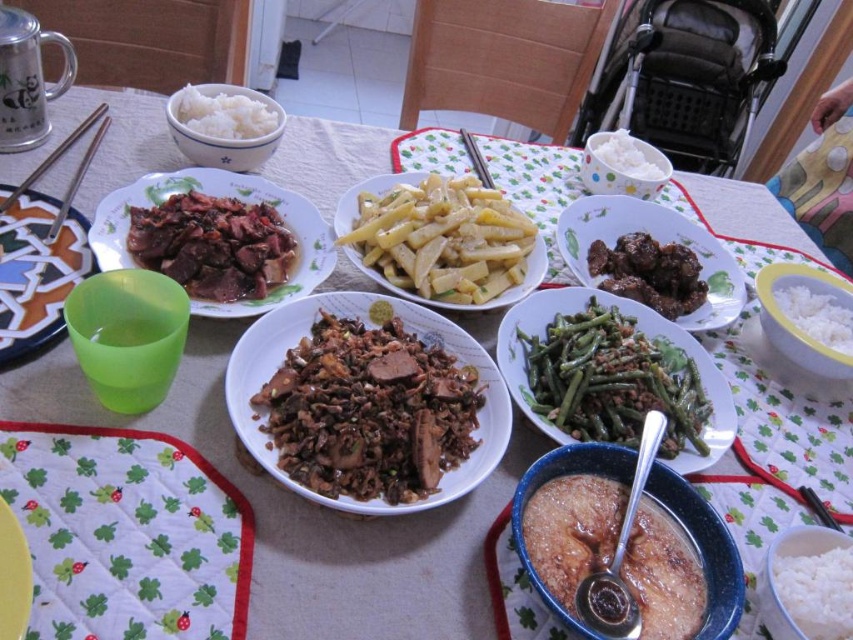
Question: Which object is positioned farthest from the slightly browned paste at center?

Choices:
 (A) dark brown glossy meat at center
 (B) brown matte meat at center
 (C) yellowish matte potato at center
 (D) brown glossy meat at center right

Answer: (A)

Question: Based on their relative distances, which object is nearer to the white matte rice at upper left?

Choices:
 (A) yellowish matte potato at center
 (B) dark brown glossy meat at center

Answer: (A)

Question: Does white matte rice at lower right appear over yellow matte plate at lower left?

Choices:
 (A) no
 (B) yes

Answer: (A)

Question: Which point is closer to the camera?

Choices:
 (A) yellowish matte potato at center
 (B) white matte rice at upper left
 (C) dark brown glossy meat at center

Answer: (A)

Question: Is green matte string beans at center bigger than white matte rice at upper center?

Choices:
 (A) no
 (B) yes

Answer: (A)

Question: Is green matte string beans at center thinner than white matte rice at lower right?

Choices:
 (A) no
 (B) yes

Answer: (A)